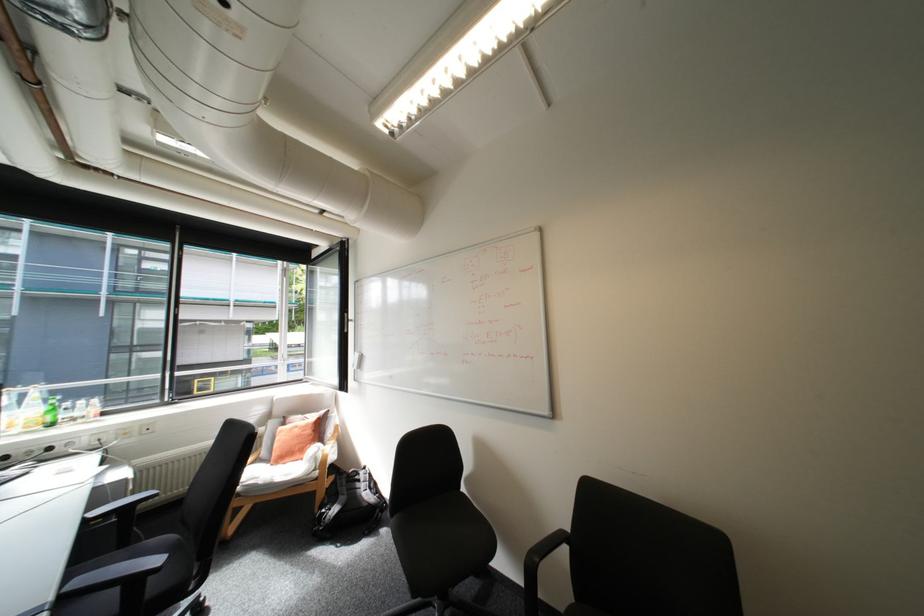
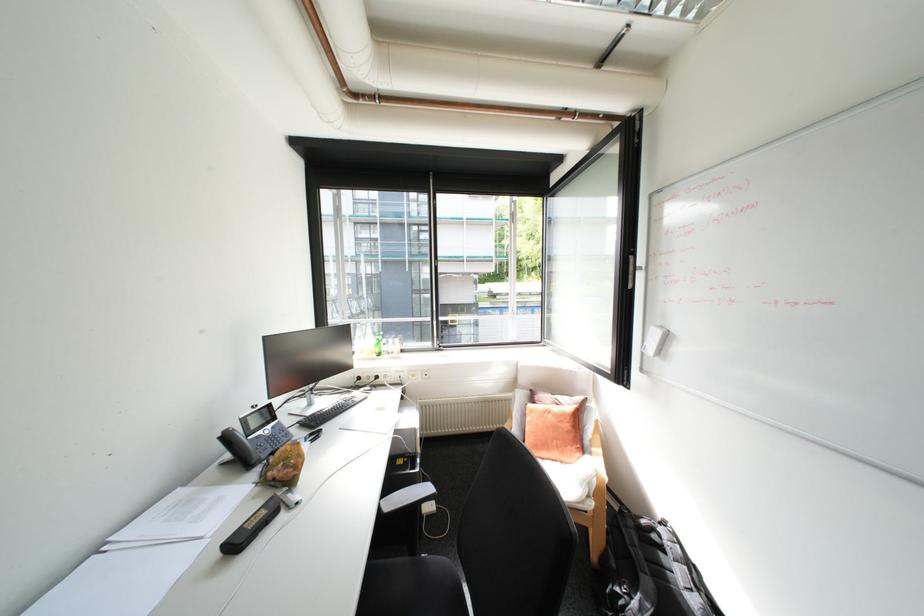
Find the pixel in the second image that matches point 353,367 in the first image.

(633, 346)